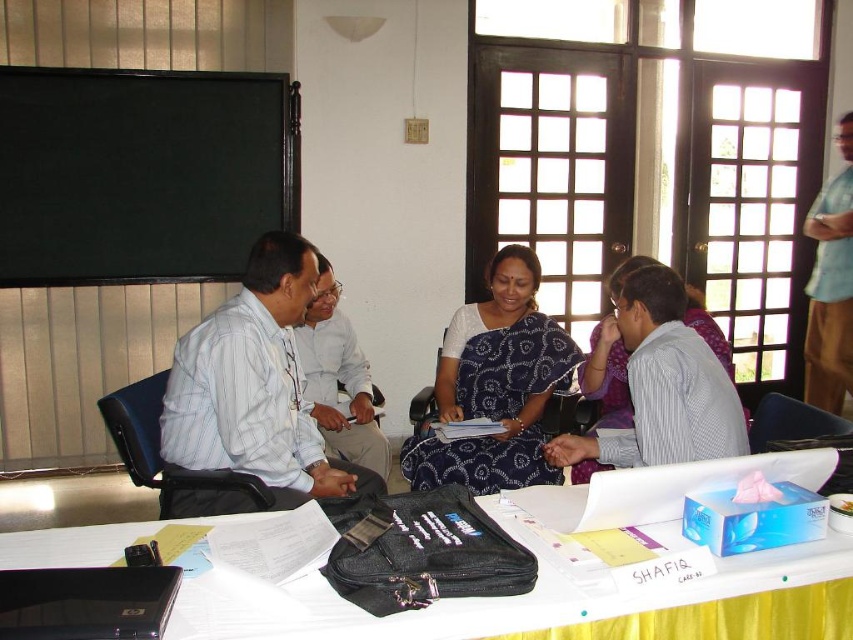
Who is higher up, black matte/blackboard at upper left or yellow fabric table at lower center?

black matte/blackboard at upper left

From the picture: Can you confirm if black matte/blackboard at upper left is wider than yellow fabric table at lower center?

Incorrect, black matte/blackboard at upper left's width does not surpass yellow fabric table at lower center's.

Identify the location of black matte/blackboard at upper left. (141, 172).

Find the location of a particular element. Image resolution: width=853 pixels, height=640 pixels. black matte/blackboard at upper left is located at coordinates (141, 172).

Which is below, yellow fabric table at lower center or matte white shirt at center?

yellow fabric table at lower center

This screenshot has height=640, width=853. What do you see at coordinates (563, 598) in the screenshot?
I see `yellow fabric table at lower center` at bounding box center [563, 598].

I want to click on yellow fabric table at lower center, so click(x=563, y=598).

Which is more to the left, blue printed sari at center or light blue shirt at upper right?

Positioned to the left is blue printed sari at center.

In the scene shown: Does blue printed sari at center have a lesser width compared to light blue shirt at upper right?

No, blue printed sari at center is not thinner than light blue shirt at upper right.

Is point (482, 392) positioned after point (819, 292)?

No, it is in front of (819, 292).

Identify the location of blue printed sari at center. Image resolution: width=853 pixels, height=640 pixels. (495, 385).